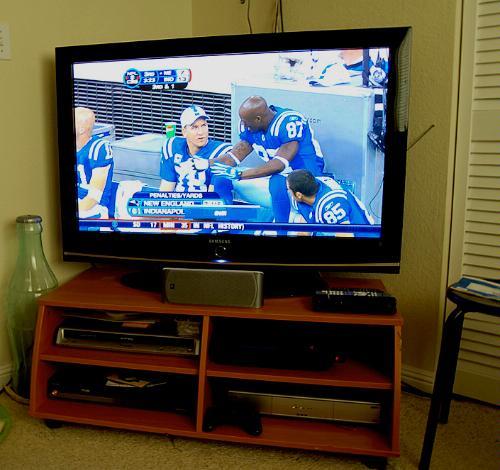
The height and width of the screenshot is (470, 500). In order to click on electronic device in this screenshot , I will do [108, 338], [90, 395], [160, 178], [297, 404], [281, 357].